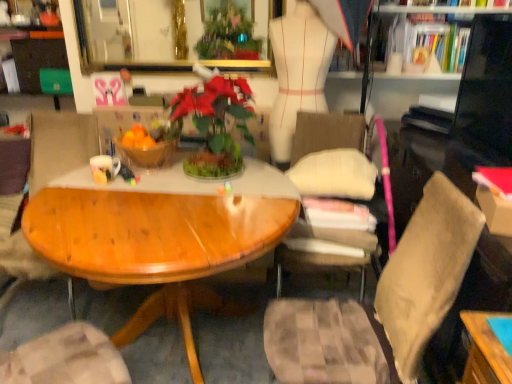
Question: Can you confirm if wooden bowl at center is taller than white paper book at upper right, which is the 1th book from back to front?

Choices:
 (A) no
 (B) yes

Answer: (B)

Question: Is wooden bowl at center closer to the viewer compared to white paper book at upper right, the second book when ordered from bottom to top?

Choices:
 (A) yes
 (B) no

Answer: (A)

Question: From a real-world perspective, is wooden bowl at center positioned under white paper book at upper right, the 3th book when ordered from front to back, based on gravity?

Choices:
 (A) no
 (B) yes

Answer: (B)

Question: Is wooden bowl at center in contact with white paper book at upper right, the second book when ordered from top to bottom?

Choices:
 (A) no
 (B) yes

Answer: (A)

Question: Is wooden bowl at center positioned far away from white paper book at upper right, the second book when ordered from bottom to top?

Choices:
 (A) no
 (B) yes

Answer: (B)

Question: Considering the positions of point (450, 43) and point (100, 180), is point (450, 43) closer or farther from the camera than point (100, 180)?

Choices:
 (A) farther
 (B) closer

Answer: (A)

Question: In terms of height, does hardcover book at upper right, arranged as the 3th book when ordered from the bottom, look taller or shorter compared to matte white mug at center-left?

Choices:
 (A) short
 (B) tall

Answer: (B)

Question: Based on their sizes in the image, would you say hardcover book at upper right, arranged as the second book when viewed from the back, is bigger or smaller than matte white mug at center-left?

Choices:
 (A) small
 (B) big

Answer: (B)

Question: Is hardcover book at upper right, the 1th book when ordered from top to bottom, wider or thinner than matte white mug at center-left?

Choices:
 (A) thin
 (B) wide

Answer: (B)

Question: Is green matte houseplant at center wider or thinner than wooden bowl at center?

Choices:
 (A) thin
 (B) wide

Answer: (B)

Question: Is green matte houseplant at center in front of or behind wooden bowl at center in the image?

Choices:
 (A) front
 (B) behind

Answer: (A)

Question: Do you think green matte houseplant at center is within wooden bowl at center, or outside of it?

Choices:
 (A) outside
 (B) inside

Answer: (A)

Question: Based on their sizes in the image, would you say green matte houseplant at center is bigger or smaller than wooden bowl at center?

Choices:
 (A) small
 (B) big

Answer: (B)

Question: From the image's perspective, is red paper book at right, which appears as the first book when viewed from the front, located above or below wooden bowl at center?

Choices:
 (A) above
 (B) below

Answer: (B)

Question: Is red paper book at right, which appears as the first book when viewed from the front, to the left or to the right of wooden bowl at center in the image?

Choices:
 (A) left
 (B) right

Answer: (B)